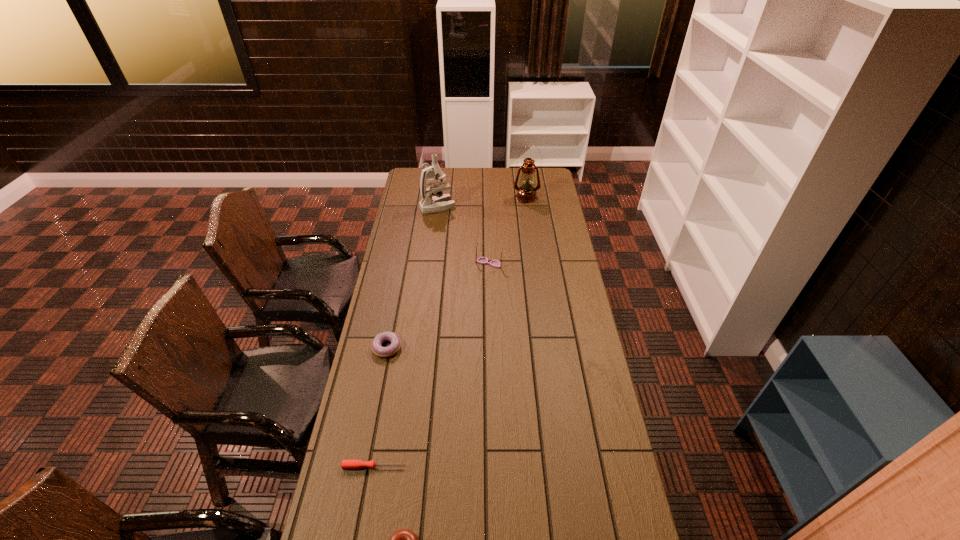
The height and width of the screenshot is (540, 960). I want to click on free space located 0.100m on the front of the spectacles, so click(490, 284).

Identify the location of vacant space located 0.230m on the right of the left doughnut. The image size is (960, 540). (462, 347).

This screenshot has height=540, width=960. I want to click on blank area located 0.190m at the tip of the shortest object, so click(x=468, y=467).

Identify the location of microscope located in the left edge section of the desktop. The image size is (960, 540). (440, 202).

Find the location of `doughnut at the left edge`. doughnut at the left edge is located at coordinates (393, 348).

Identify the location of screwdriver positioned at the left edge. This screenshot has width=960, height=540. [x=345, y=464].

The height and width of the screenshot is (540, 960). I want to click on object at the right edge, so pyautogui.click(x=526, y=193).

Find the location of a particular element. free location at the far edge of the desktop is located at coordinates (464, 180).

In the image, there is a desktop. Find the location of `vacant space at the left edge`. vacant space at the left edge is located at coordinates (402, 215).

Identify the location of vacant space at the right edge of the desktop. The width and height of the screenshot is (960, 540). (560, 348).